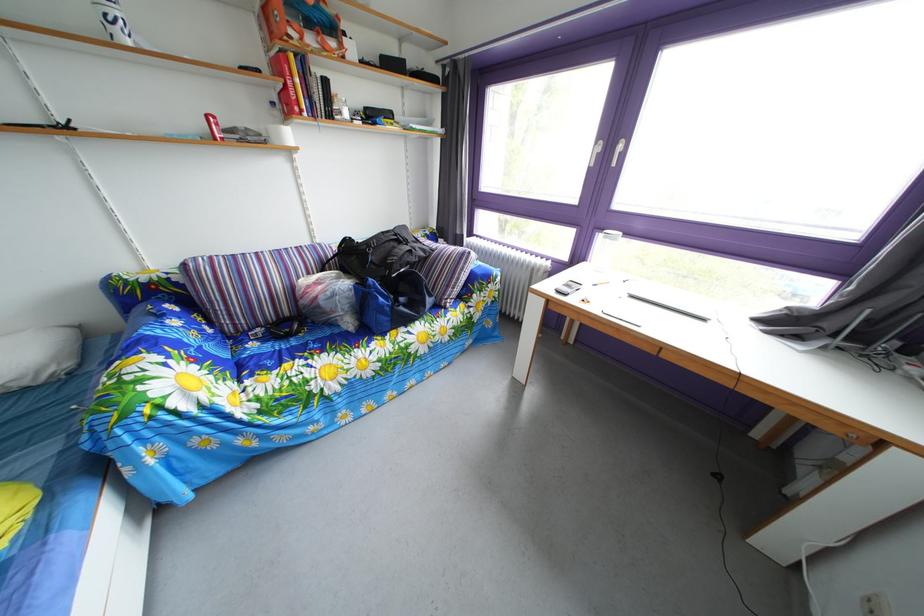
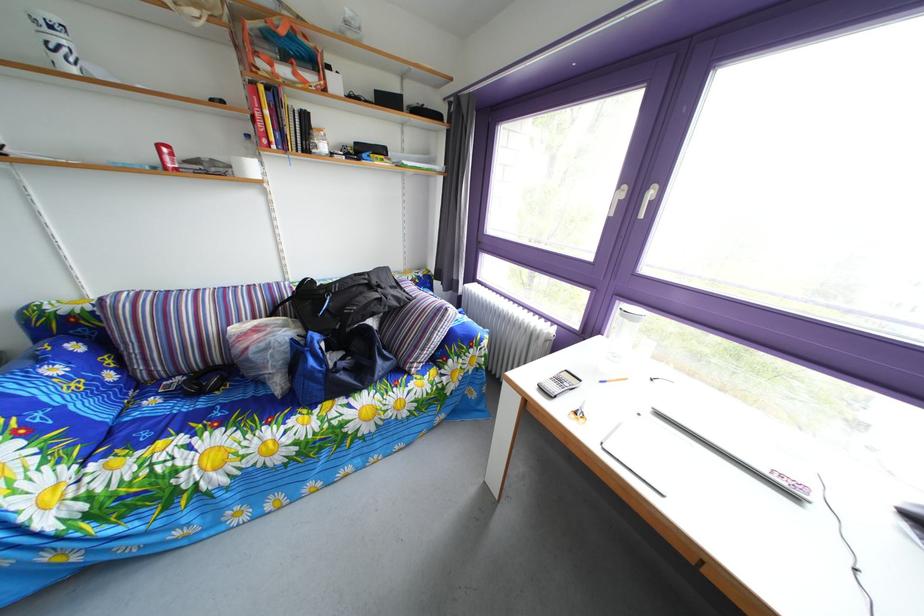
Question: Based on the continuous images, in which direction is the camera rotating? Reply with the corresponding letter.

Choices:
 (A) Left
 (B) Right
 (C) Up
 (D) Down

Answer: (A)